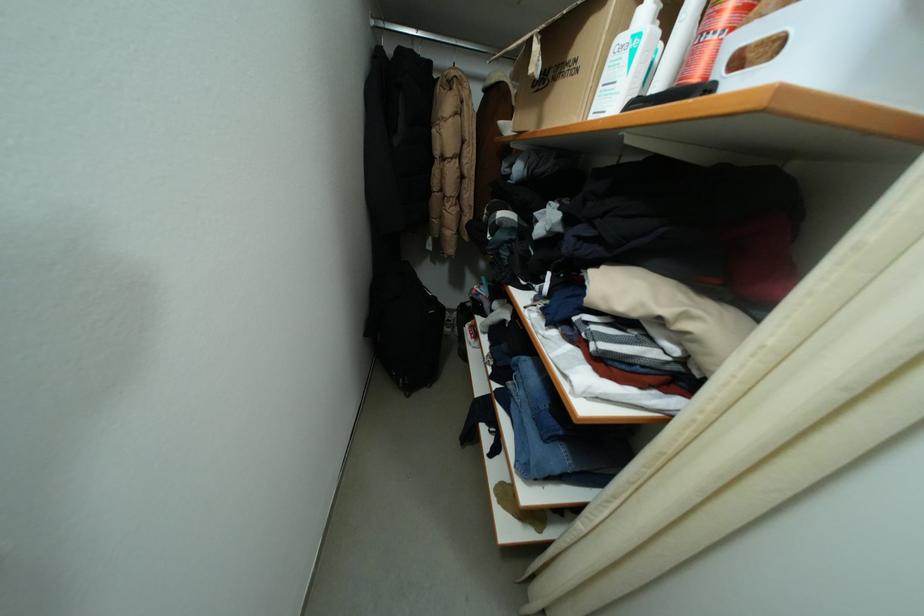
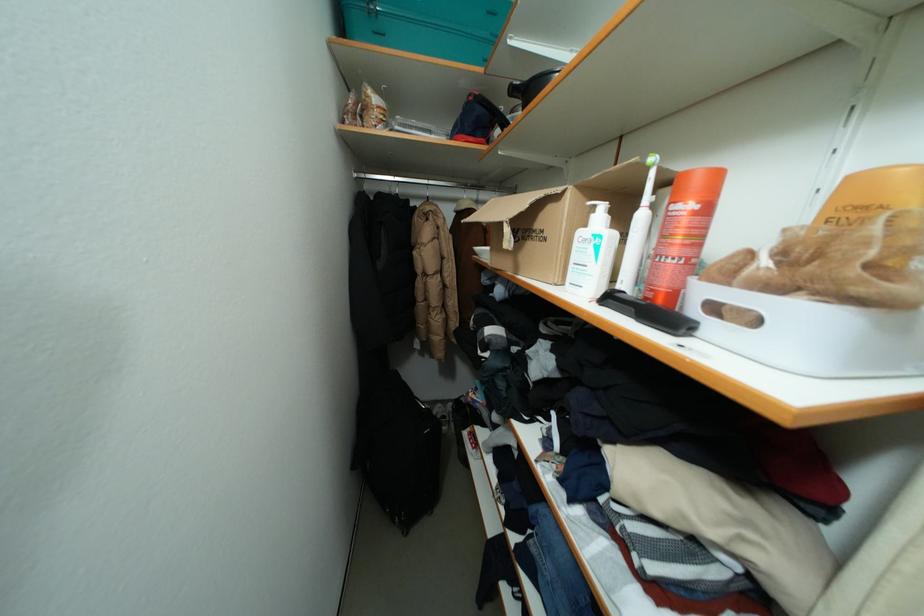
The point at (626,43) is marked in the first image. Where is the corresponding point in the second image?

(589, 236)